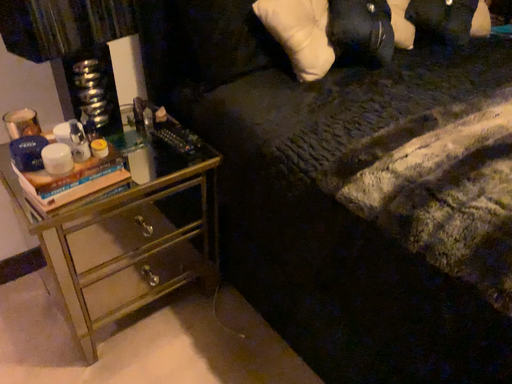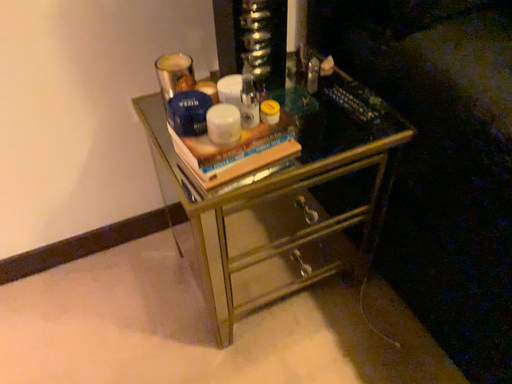
Question: How did the camera likely rotate when shooting the video?

Choices:
 (A) rotated left
 (B) rotated right

Answer: (A)